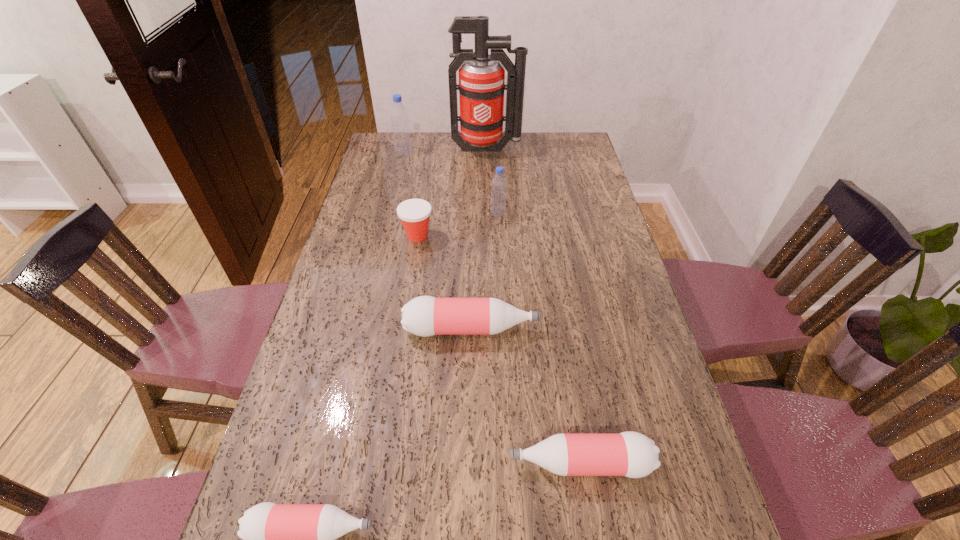
Identify which pink bottle is the closest to the farthest pink bottle. Please provide its 2D coordinates. Your answer should be formatted as a tuple, i.e. [(x, y)], where the tuple contains the x and y coordinates of a point satisfying the conditions above.

[(631, 454)]

This screenshot has height=540, width=960. What are the coordinates of `vacant space that satisfies the following two spatial constraints: 1. on the front label side of the tallest object; 2. with the cap open on the third farthest bottle` in the screenshot? It's located at (491, 329).